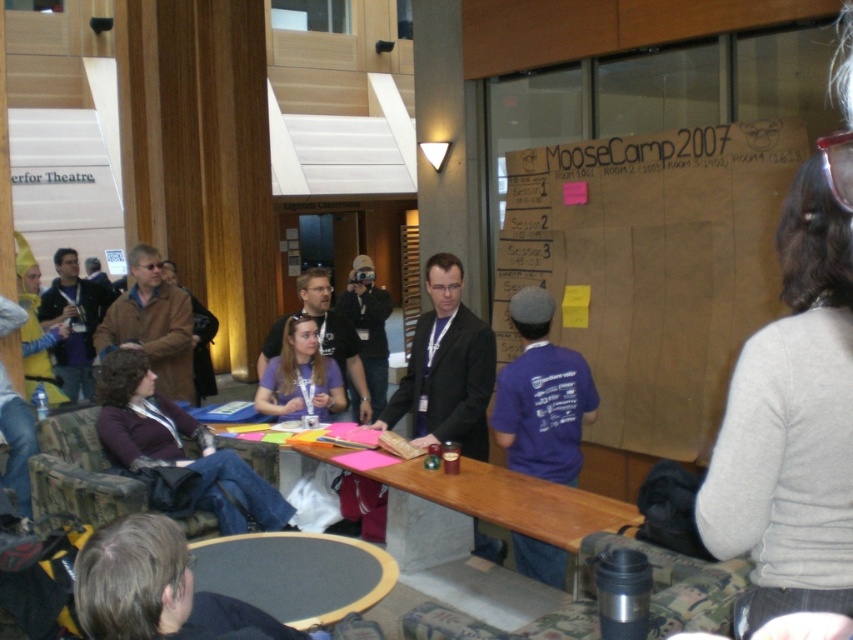
You are organizing a workshop and need to place a decorative banner on the table. The banner is 1 meter long. The black felt table at lower center and brown cardboard at center are both available. Which surface can accommodate the banner without it hanging off the edges?

The black felt table at lower center is behind the brown cardboard at center, so the banner can be placed on the black felt table at lower center since tables are typically longer than cardboard surfaces.

You are a photographer trying to capture a candid shot of the person in the matte black shirt at center without them noticing the matte black camera at center. Can you position yourself in a way that the camera is between you and the person?

The matte black camera at center is further to the viewer than the matte black shirt at center, so yes, you can position yourself behind the camera so it is between you and the person in the matte black shirt at center.